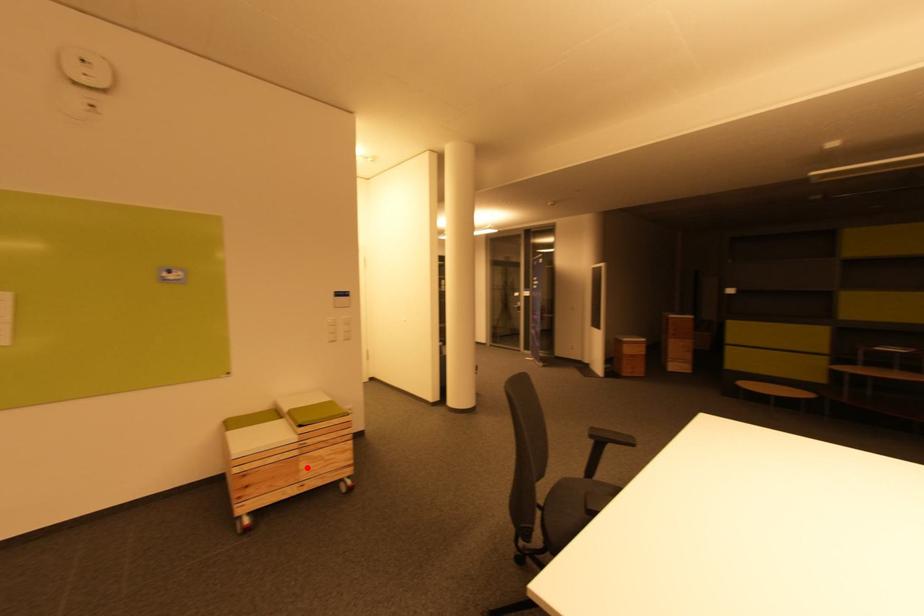
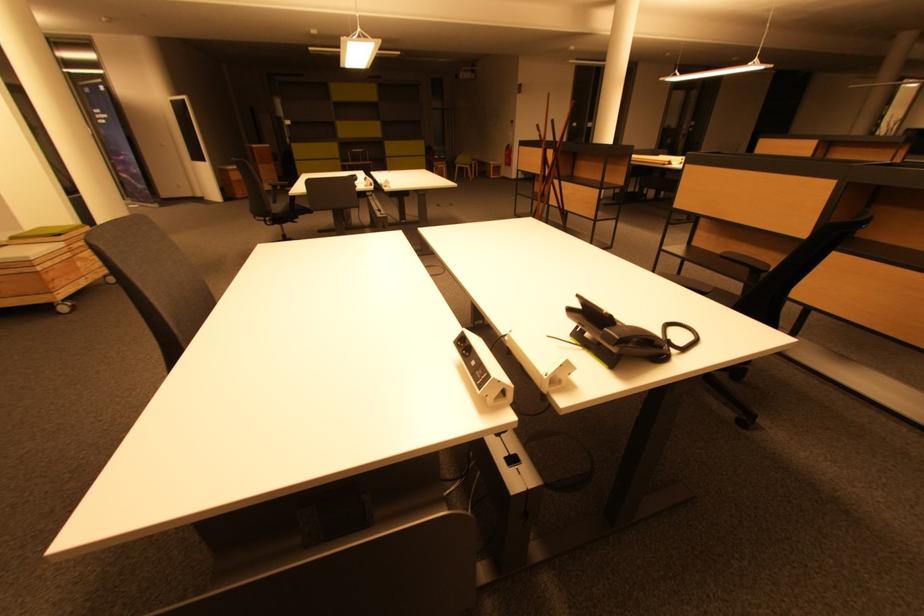
Question: I am providing you with two images of the same scene from different viewpoints. Image1 has a red point marked. In image2, the corresponding 3D location appears at what relative position? Reply with the corresponding letter.

Choices:
 (A) Closer
 (B) Farther

Answer: (B)